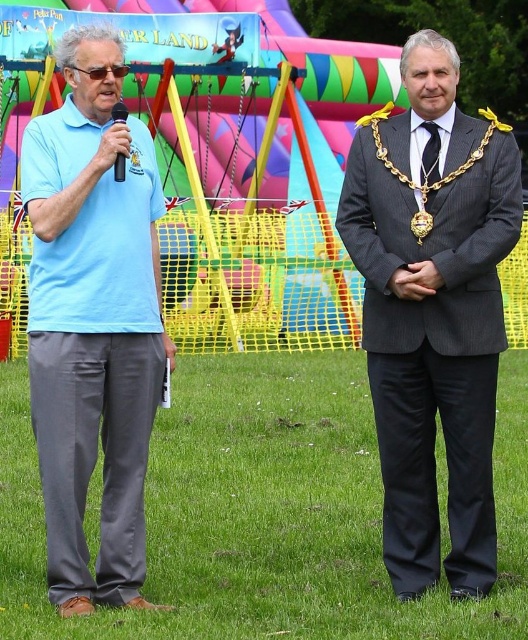
Question: Which object is positioned closest to the black silk tie at center?

Choices:
 (A) black plastic microphone at left
 (B) dark gray pinstripe suit at center
 (C) light blue cotton shirt at left

Answer: (B)

Question: Can you confirm if dark gray pinstripe suit at center is thinner than light blue cotton shirt at left?

Choices:
 (A) yes
 (B) no

Answer: (B)

Question: Does black silk tie at center appear under black plastic microphone at left?

Choices:
 (A) yes
 (B) no

Answer: (A)

Question: Is dark gray pinstripe suit at center further to camera compared to black plastic microphone at left?

Choices:
 (A) no
 (B) yes

Answer: (A)

Question: Which of the following is the closest to the observer?

Choices:
 (A) (112, 113)
 (B) (437, 141)
 (C) (480, 128)

Answer: (A)

Question: Which of the following is the farthest from the observer?

Choices:
 (A) light blue cotton shirt at left
 (B) black plastic microphone at left
 (C) black silk tie at center

Answer: (C)